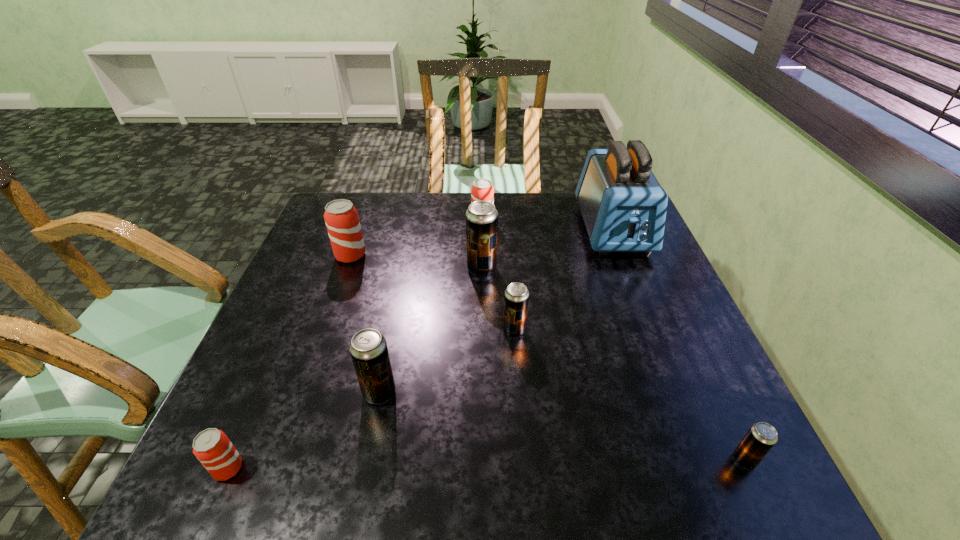
Identify the location of object that is positioned at the near right corner. (761, 437).

Locate an element on the screen. This screenshot has width=960, height=540. vacant point at the far edge is located at coordinates (544, 193).

In the image, there is a desktop. In order to click on free space at the near edge in this screenshot , I will do `click(570, 461)`.

I want to click on free location at the left edge, so click(326, 345).

This screenshot has height=540, width=960. Identify the location of free space at the right edge. (738, 409).

You are a GUI agent. You are given a task and a screenshot of the screen. Output one action in this format:
    pyautogui.click(x=<x>, y=<y>)
    Task: Click on the free space between the farthest orange beer can and the sixth farthest object
    
    Given the screenshot: What is the action you would take?
    pyautogui.click(x=431, y=306)

Identify the location of empty space that is in between the fourth nearest beer can and the farthest beer can. The image size is (960, 540). (498, 275).

Where is `free point between the farthest orange beer can and the rightmost beer can`? free point between the farthest orange beer can and the rightmost beer can is located at coordinates (613, 340).

The height and width of the screenshot is (540, 960). I want to click on vacant area between the rightmost orange beer can and the nearest black beer can, so click(x=613, y=340).

Identify the location of vacant area between the leftmost black beer can and the third black beer can from left to right. (446, 361).